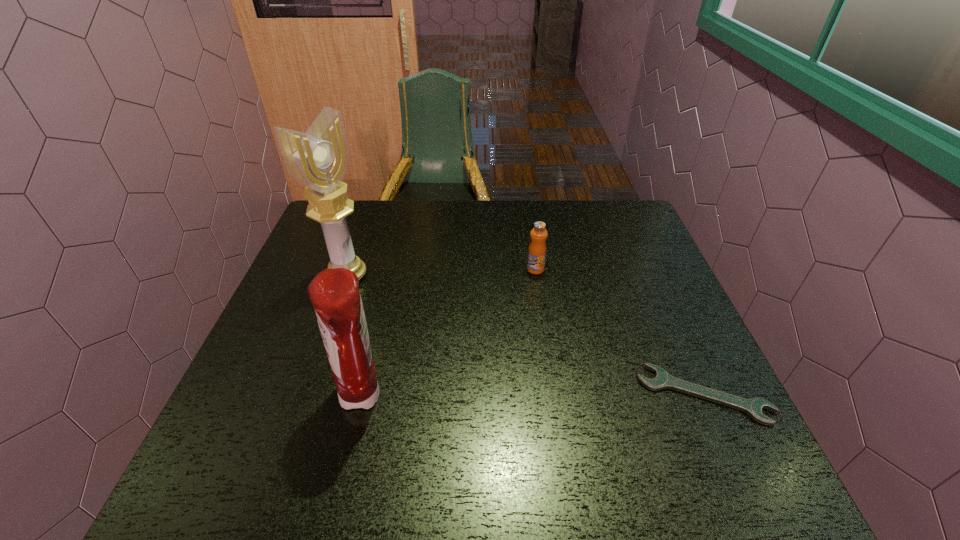
What are the coordinates of `vacant space located 0.180m on the front label of the second object from right to left` in the screenshot? It's located at (520, 320).

Find the location of a particular element. This screenshot has height=540, width=960. vacant space situated 0.220m on the front label of the second object from right to left is located at coordinates (517, 332).

The height and width of the screenshot is (540, 960). Find the location of `free space located on the front label of the second object from right to left`. free space located on the front label of the second object from right to left is located at coordinates (519, 326).

What are the coordinates of `free space located on the front-facing side of the tallest object` in the screenshot? It's located at (474, 347).

The width and height of the screenshot is (960, 540). In order to click on vacant area situated 0.230m on the front-facing side of the tallest object in this screenshot , I will do `click(428, 321)`.

Locate an element on the screen. vacant space located 0.220m on the front-facing side of the tallest object is located at coordinates (425, 320).

Identify the location of condiment located in the near edge section of the desktop. This screenshot has width=960, height=540. (334, 294).

Where is `wrench positioned at the near edge`? wrench positioned at the near edge is located at coordinates (753, 407).

The width and height of the screenshot is (960, 540). I want to click on object at the left edge, so click(x=318, y=159).

Locate an element on the screen. object present at the right edge is located at coordinates (753, 407).